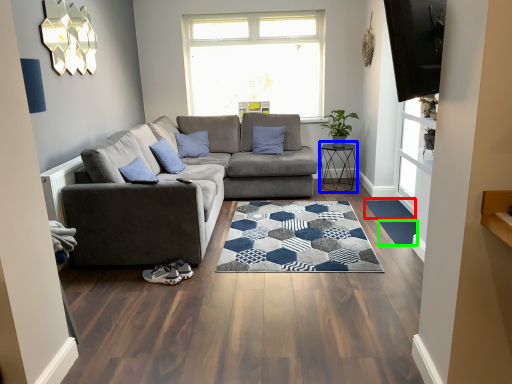
Question: Estimate the real-world distances between objects in this image. Which object is closer to flat (highlighted by a red box), table (highlighted by a blue box) or mat (highlighted by a green box)?

Choices:
 (A) table
 (B) mat

Answer: (B)